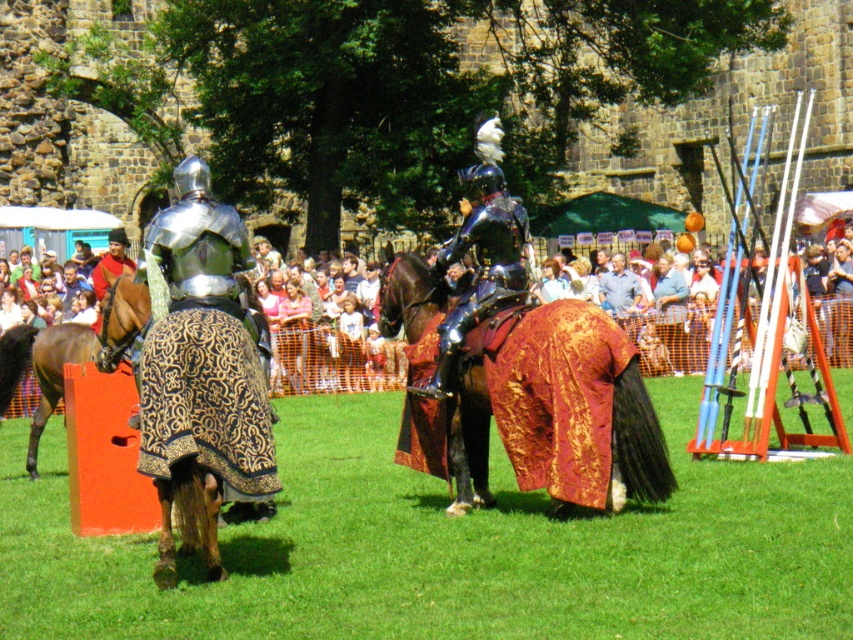
You are a knight preparing to cross a field to reach the castle. You have to decide whether to walk through the green grass at lower center or take the path over the golden patterned blanket at rear left. Which path is wider and safer for your horse?

The green grass at lower center is wider than the golden patterned blanket at rear left, so it is safer for your horse to take the path through the green grass at lower center.

You are a knight in the medieval event and need to navigate between two points marked on the map. The first point is at coordinate point [579,529] and the second is at point [218,474]. Which point is closer to you?

Point [579,529] is further to the viewer than point [218,474], so the second point is closer to you.

You are a knight preparing to cross a bridge that is as wide as the green grass at lower center. Can your brown glossy horse at left fit on the bridge without going over the edge?

The green grass at lower center is wider than the brown glossy horse at left, so the bridge is wide enough for the brown glossy horse at left to cross safely without going over the edge.